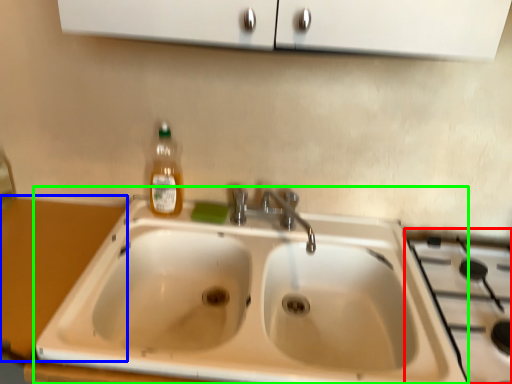
Question: Which is nearer to the gas stove (highlighted by a red box)? counter top (highlighted by a blue box) or sink (highlighted by a green box).

Choices:
 (A) counter top
 (B) sink

Answer: (B)